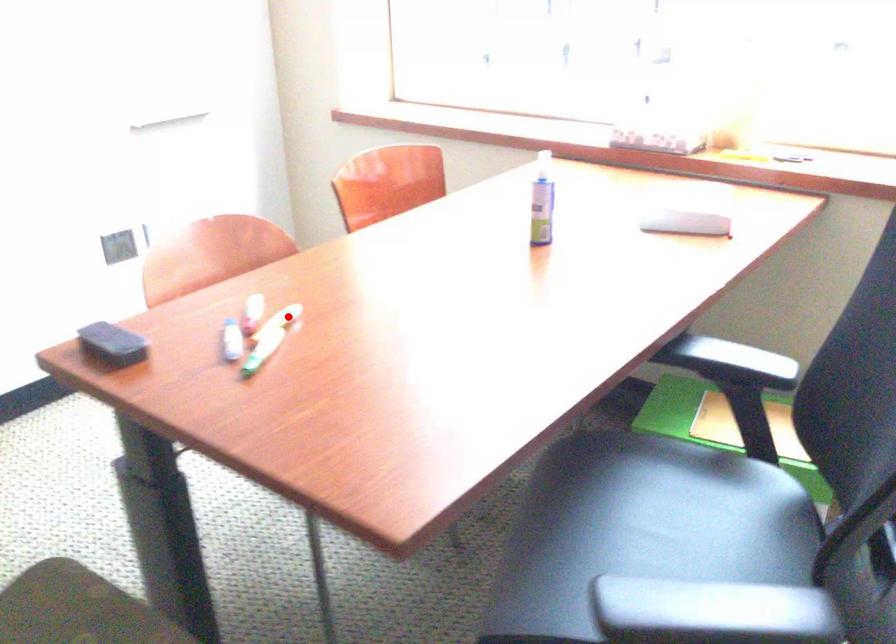
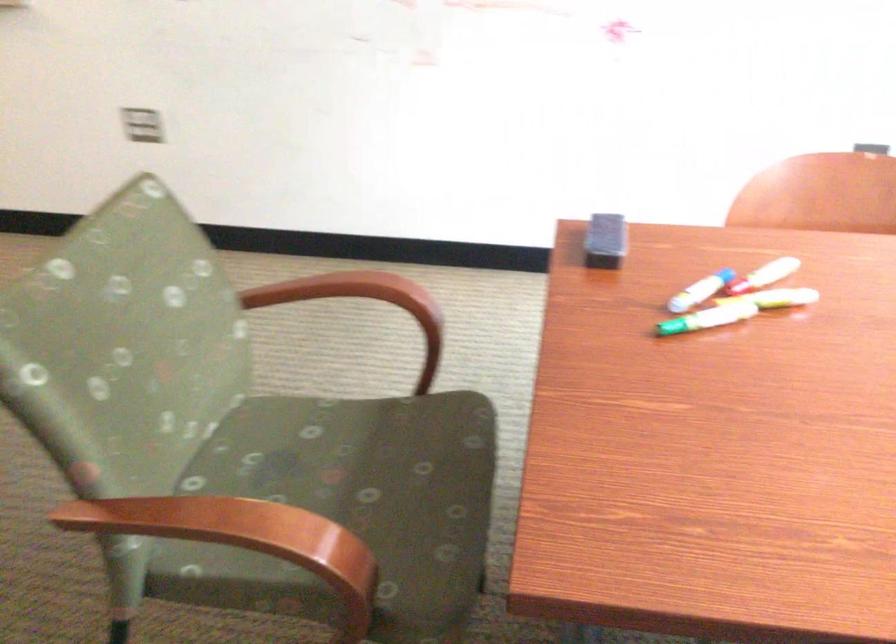
Question: I am providing you with two images of the same scene from different viewpoints. A red point is marked on the first image. Can you still see the location of the red point in image 2?

Choices:
 (A) Yes
 (B) No

Answer: (A)